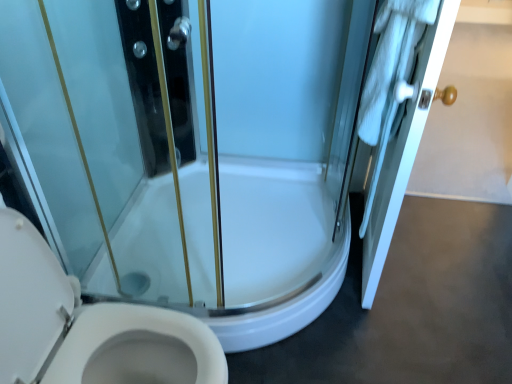
Question: Based on their positions, is white glossy toilet at lower left located to the left or right of white wood door at right?

Choices:
 (A) right
 (B) left

Answer: (B)

Question: Is white glossy toilet at lower left taller or shorter than white wood door at right?

Choices:
 (A) short
 (B) tall

Answer: (A)

Question: Considering their positions, is white glossy toilet at lower left located in front of or behind white wood door at right?

Choices:
 (A) front
 (B) behind

Answer: (A)

Question: In the image, is white wood door at right positioned in front of or behind white glossy toilet at lower left?

Choices:
 (A) front
 (B) behind

Answer: (B)

Question: Is point (420, 44) positioned closer to the camera than point (67, 294)?

Choices:
 (A) closer
 (B) farther

Answer: (A)

Question: From the image's perspective, is white wood door at right positioned above or below white glossy toilet at lower left?

Choices:
 (A) above
 (B) below

Answer: (A)

Question: Choose the correct answer: Is white wood door at right inside white glossy toilet at lower left or outside it?

Choices:
 (A) outside
 (B) inside

Answer: (A)